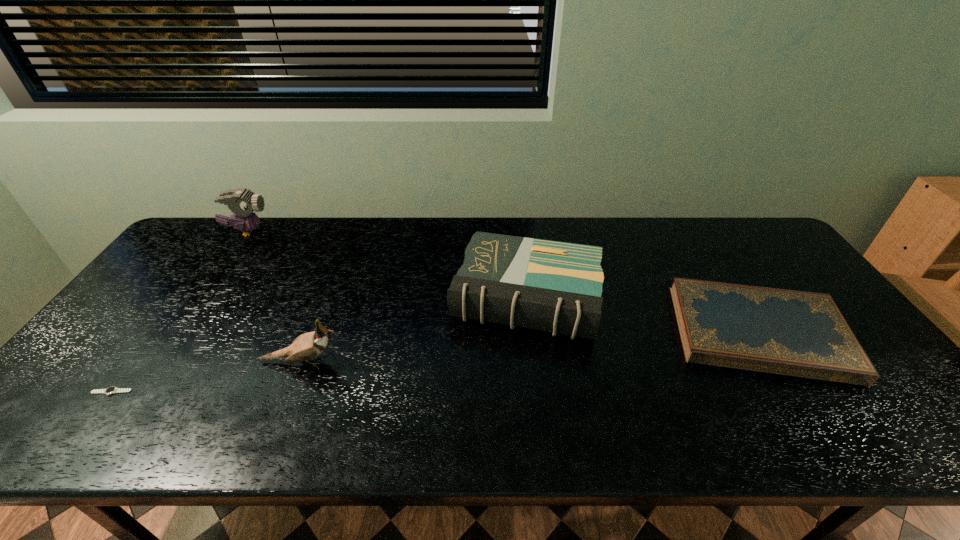
Locate an element on the screen. unoccupied position between the third object from left to right and the farthest object is located at coordinates (274, 296).

You are a GUI agent. You are given a task and a screenshot of the screen. Output one action in this format:
    pyautogui.click(x=<x>, y=<y>)
    Task: Click on the empty location between the fourth object from left to right and the rightmost object
    Image resolution: width=960 pixels, height=540 pixels.
    Given the screenshot: What is the action you would take?
    pyautogui.click(x=642, y=314)

Image resolution: width=960 pixels, height=540 pixels. In order to click on object that stands as the second closest to the farthest object in this screenshot , I will do `click(111, 390)`.

Locate which object ranks in proximity to the nearer bird. Please provide its 2D coordinates. Your answer should be formatted as a tuple, i.e. [(x, y)], where the tuple contains the x and y coordinates of a point satisfying the conditions above.

[(552, 286)]

You are a GUI agent. You are given a task and a screenshot of the screen. Output one action in this format:
    pyautogui.click(x=<x>, y=<y>)
    Task: Click on the vacant space that satisfies the following two spatial constraints: 1. at the beak of the left bird; 2. on the back side of the fourth tallest object
    
    Given the screenshot: What is the action you would take?
    pyautogui.click(x=178, y=332)

In order to click on free point that satisfies the following two spatial constraints: 1. on the back side of the left paperback book; 2. on the right side of the shortest object in this screenshot , I will do `click(181, 297)`.

Locate an element on the screen. vacant region that satisfies the following two spatial constraints: 1. at the beak of the shorter paperback book; 2. on the left side of the left bird is located at coordinates (178, 332).

At what (x,y) coordinates should I click in order to perform the action: click on vacant space that satisfies the following two spatial constraints: 1. at the beak of the left paperback book; 2. on the right side of the farthest object. Please return your answer as a coordinate pair (x, y). Image resolution: width=960 pixels, height=540 pixels. Looking at the image, I should click on (202, 297).

In order to click on vacant area in the image that satisfies the following two spatial constraints: 1. on the front side of the second object from right to left; 2. at the face of the third object from left to right in this screenshot , I will do `click(534, 362)`.